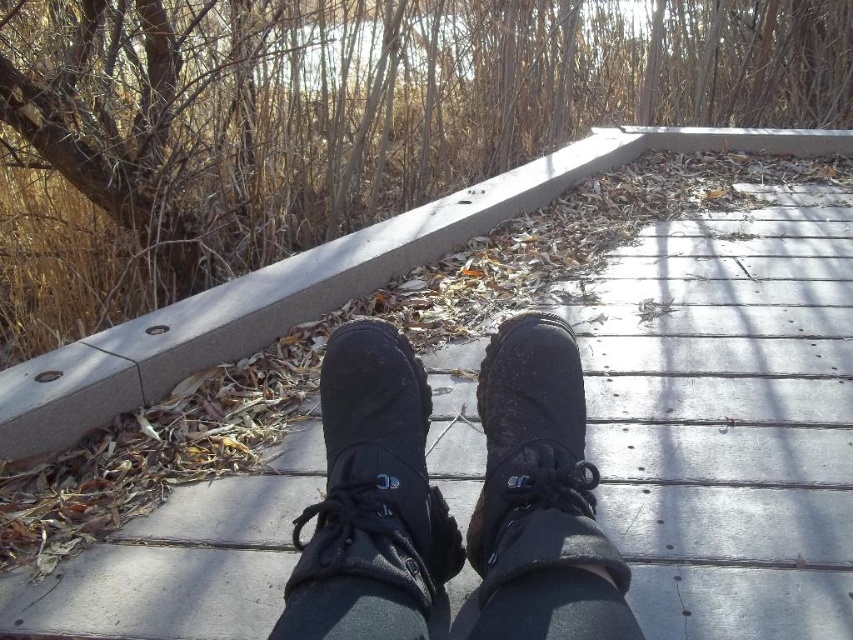
Consider the image. Which is more to the left, black leather boots at center or matte black boot at center?

black leather boots at center is more to the left.

Identify the location of black leather boots at center. (445, 502).

Image resolution: width=853 pixels, height=640 pixels. Find the location of `black leather boots at center`. black leather boots at center is located at coordinates (445, 502).

Between black leather boots at center and black leather boot at center, which one appears on the right side from the viewer's perspective?

black leather boots at center

I want to click on black leather boots at center, so click(x=445, y=502).

Who is more distant from viewer, [454,532] or [523,435]?

Point [454,532]

The height and width of the screenshot is (640, 853). I want to click on black leather boot at center, so click(x=370, y=500).